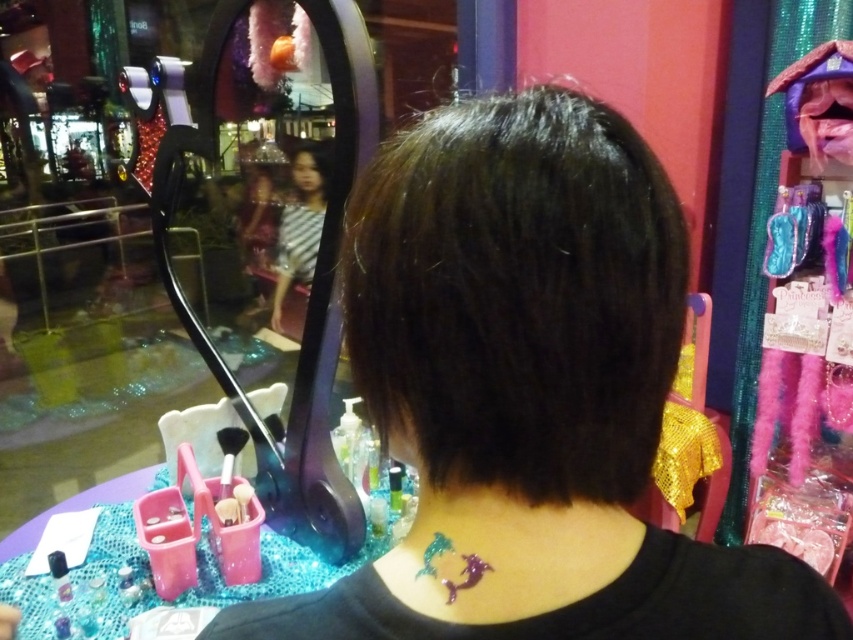
You are a customer in the store and want to take a photo of the dark shiny hair at center. Where should you position your camera to capture it best?

The dark shiny hair at center is located at point (518, 294) in the image, so position the camera directly facing that coordinate to capture it best.

You are a customer in a beauty store trying to choose between two hair products. You see the shiny black hair at center and the dark shiny hair at center. Which one is closer to the mirror with a black frame?

Both the shiny black hair at center and the dark shiny hair at center are 0.76 inches apart from each other, so they are equally close to the mirror with a black frame.

You are a customer in a beauty store looking at the vanity table setup. You notice the dark shiny hair at center and the metallic purple mermaid at center back. Which object is positioned more to the right side of the vanity table?

The dark shiny hair at center is positioned to the right of the metallic purple mermaid at center back, so the dark shiny hair at center is more to the right side of the vanity table.